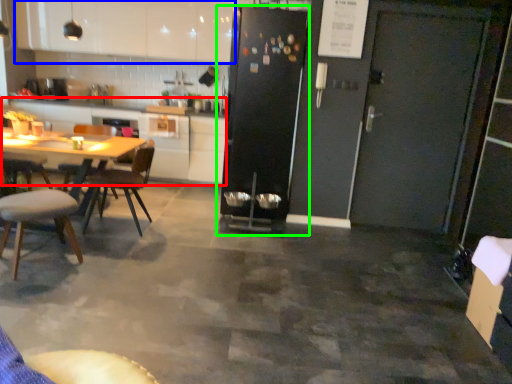
Question: Which object is the closest to the counter top (highlighted by a red box)? Choose among these: cabinetry (highlighted by a blue box) or refrigerator (highlighted by a green box).

Choices:
 (A) cabinetry
 (B) refrigerator

Answer: (A)